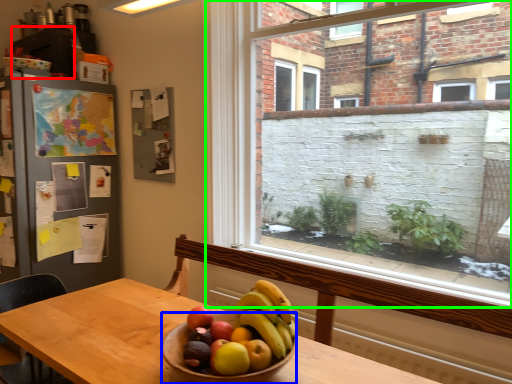
Question: Which object is the closest to the cabinetry (highlighted by a red box)? Choose among these: bowl (highlighted by a blue box) or window (highlighted by a green box).

Choices:
 (A) bowl
 (B) window

Answer: (B)